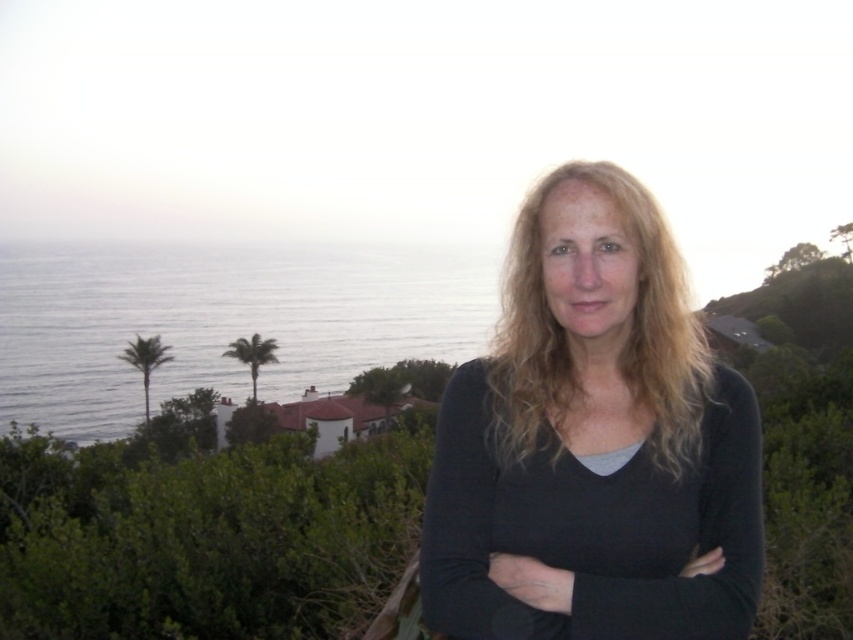
Question: Is blue water at left behind blonde wavy hair at center?

Choices:
 (A) yes
 (B) no

Answer: (A)

Question: Is black matte shirt at center positioned behind blonde wavy hair at center?

Choices:
 (A) no
 (B) yes

Answer: (A)

Question: Which object is the farthest from the black matte arm at center?

Choices:
 (A) black matte shirt at center
 (B) blonde wavy hair at center
 (C) blue water at left

Answer: (C)

Question: Which point is closer to the camera?

Choices:
 (A) (682, 605)
 (B) (535, 512)
 (C) (33, 362)
 (D) (685, 362)

Answer: (A)

Question: Which object is closer to the camera taking this photo?

Choices:
 (A) blue water at left
 (B) blonde wavy hair at center

Answer: (B)

Question: Can you confirm if blue water at left is bigger than blonde wavy hair at center?

Choices:
 (A) yes
 (B) no

Answer: (A)